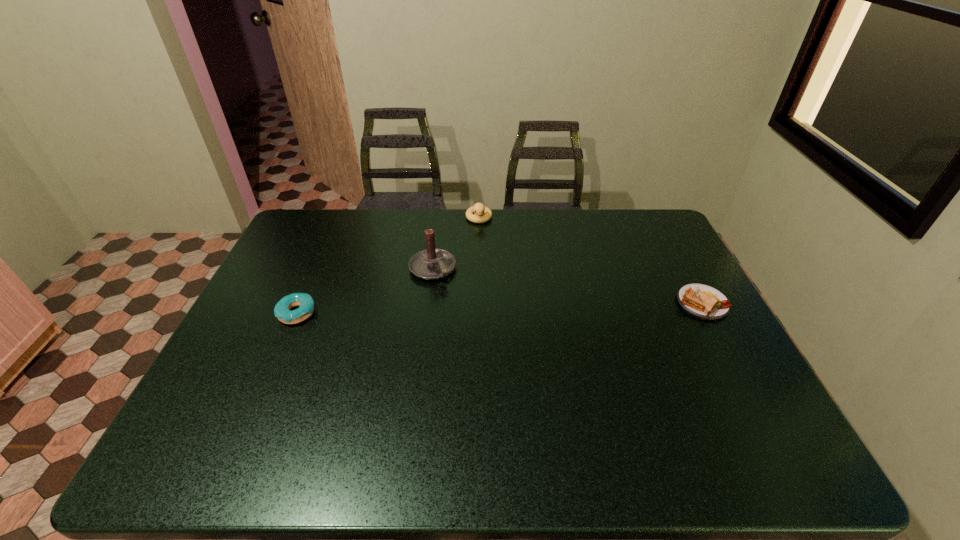
In order to click on free area in between the sandwich and the second farthest object in this screenshot , I will do `click(567, 286)`.

Where is `free point between the leftmost object and the third nearest object`? free point between the leftmost object and the third nearest object is located at coordinates pyautogui.click(x=365, y=291).

This screenshot has height=540, width=960. I want to click on vacant area between the rightmost object and the second farthest object, so (x=567, y=286).

The image size is (960, 540). I want to click on object identified as the second closest to the tallest object, so click(282, 311).

Identify the location of object that is the second nearest to the doughnut. This screenshot has height=540, width=960. (478, 208).

The height and width of the screenshot is (540, 960). In order to click on free location that satisfies the following two spatial constraints: 1. on the back side of the farthest object; 2. on the left side of the tallest object in this screenshot , I will do `click(439, 218)`.

You are a GUI agent. You are given a task and a screenshot of the screen. Output one action in this format:
    pyautogui.click(x=<x>, y=<y>)
    Task: Click on the blank space that satisfies the following two spatial constraints: 1. on the front side of the second object from left to right; 2. on the right side of the rightmost object
    Image resolution: width=960 pixels, height=540 pixels.
    Given the screenshot: What is the action you would take?
    pyautogui.click(x=428, y=303)

The height and width of the screenshot is (540, 960). What are the coordinates of `vacant position in the image that satisfies the following two spatial constraints: 1. on the back side of the second tallest object; 2. on the right side of the tallest object` in the screenshot? It's located at [439, 218].

In order to click on vacant area in the image that satisfies the following two spatial constraints: 1. on the front side of the sandwich; 2. on the left side of the candle in this screenshot , I will do `click(428, 303)`.